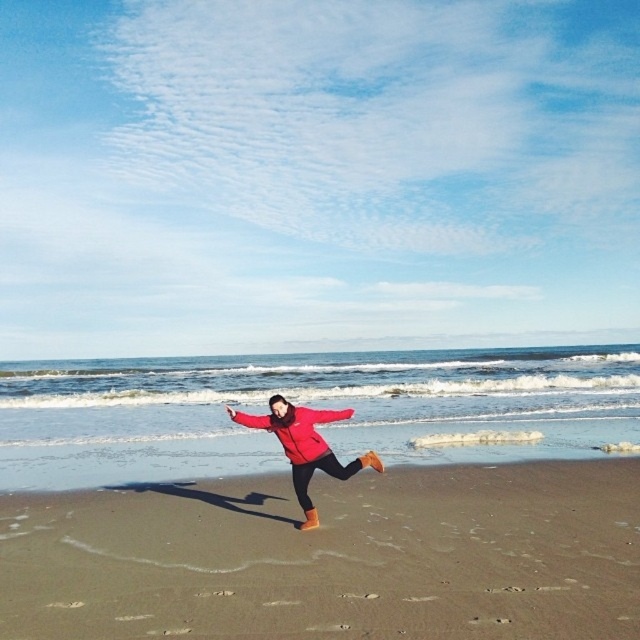
You are a photographer trying to capture the perfect shot of the brown sandy beach at center and the matte red jacket at center. Based on their positions, which object should you focus on first to ensure both are in frame?

The brown sandy beach at center is below the matte red jacket at center, so you should focus on the matte red jacket at center first to ensure both are in frame.